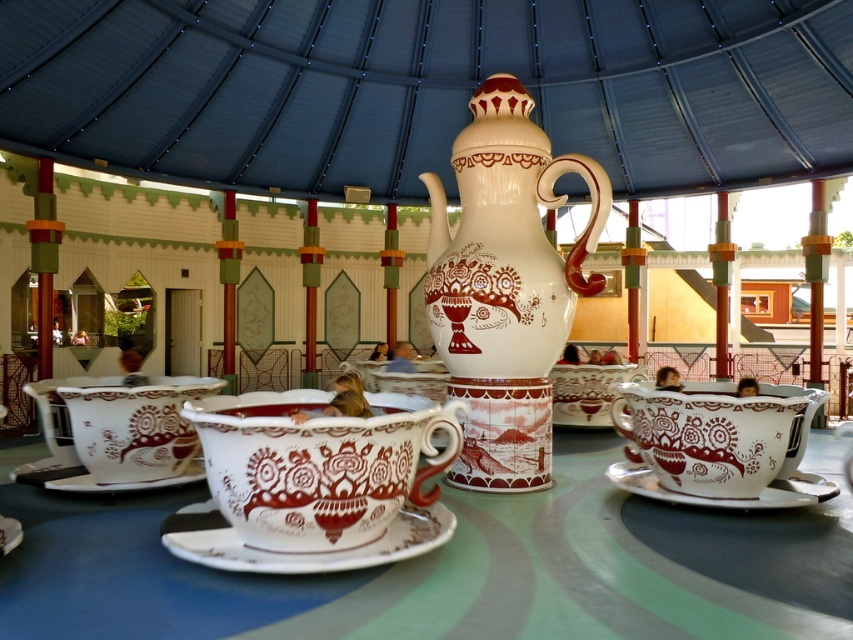
Does white ceramic table at center lie behind brown matte teacup at center?

That is False.

Measure the distance between white ceramic table at center and brown matte teacup at center.

white ceramic table at center and brown matte teacup at center are 35.81 inches apart from each other.

I want to click on white ceramic table at center, so click(x=456, y=568).

What are the coordinates of `white ceramic table at center` in the screenshot? It's located at (456, 568).

From the picture: Which of these two, matte porcelain teacup at lower left or white glossy saucer at center, stands shorter?

white glossy saucer at center

Is matte porcelain teacup at lower left thinner than white glossy saucer at center?

Yes, matte porcelain teacup at lower left is thinner than white glossy saucer at center.

The width and height of the screenshot is (853, 640). Identify the location of matte porcelain teacup at lower left. (134, 426).

Identify the location of matte porcelain teacup at lower left. The height and width of the screenshot is (640, 853). (134, 426).

Which of these two, matte ceramic teapot at center or white glossy teacup at lower right, stands shorter?

Standing shorter between the two is white glossy teacup at lower right.

Is matte ceramic teapot at center in front of white glossy teacup at lower right?

No, it is behind white glossy teacup at lower right.

Who is more distant from viewer, (474, 300) or (647, 401)?

The point (474, 300) is behind.

You are a GUI agent. You are given a task and a screenshot of the screen. Output one action in this format:
    pyautogui.click(x=<x>, y=<y>)
    Task: Click on the matte ceramic teapot at center
    This screenshot has width=853, height=640.
    Given the screenshot: What is the action you would take?
    pyautogui.click(x=505, y=285)